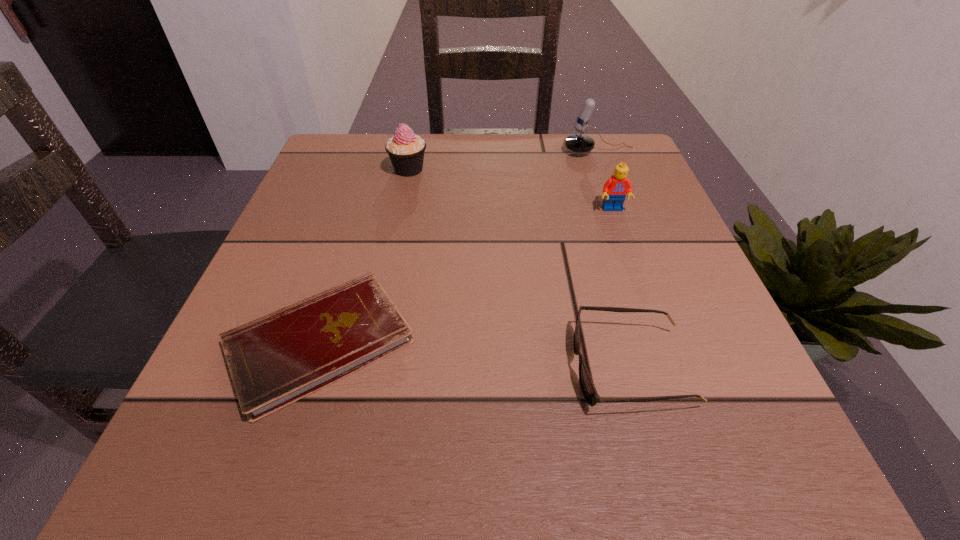
Where is `free space that satisfies the following two spatial constraints: 1. on the front side of the farthest object; 2. on the lenses of the sunglasses`? The height and width of the screenshot is (540, 960). free space that satisfies the following two spatial constraints: 1. on the front side of the farthest object; 2. on the lenses of the sunglasses is located at coordinates (681, 368).